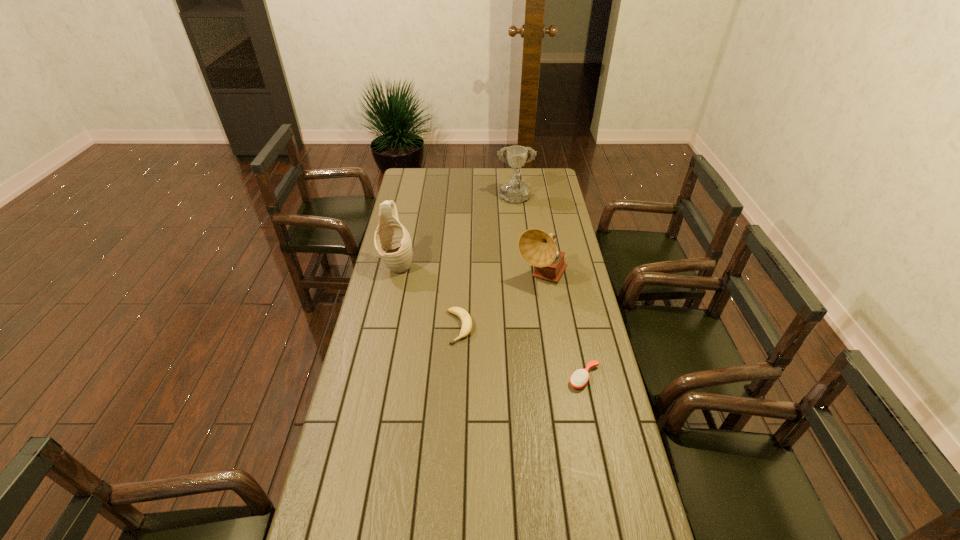
Find the location of a particular element. vacant point located between the nearest object and the leftmost object is located at coordinates (491, 322).

This screenshot has width=960, height=540. I want to click on unoccupied area between the farthest object and the second object from left to right, so click(x=487, y=264).

Locate an element on the screen. This screenshot has width=960, height=540. vacant area that lies between the phonograph record and the leftmost object is located at coordinates (469, 272).

This screenshot has width=960, height=540. I want to click on free spot between the farthest object and the leftmost object, so click(x=456, y=233).

Identify the location of free space that is in between the farthest object and the leftmost object. (456, 233).

At what (x,y) coordinates should I click in order to perform the action: click on the second closest object relative to the pitcher. Please return your answer as a coordinate pair (x, y). This screenshot has width=960, height=540. Looking at the image, I should click on (538, 248).

The width and height of the screenshot is (960, 540). What are the coordinates of `the third closest object to the award` in the screenshot? It's located at (466, 320).

At what (x,y) coordinates should I click in order to perform the action: click on free space that satisfies the following two spatial constraints: 1. on the horn of the phonograph record; 2. on the left side of the hairbrush. Please return your answer as a coordinate pair (x, y). The height and width of the screenshot is (540, 960). Looking at the image, I should click on (558, 377).

The width and height of the screenshot is (960, 540). Identify the location of vacant space that satisfies the following two spatial constraints: 1. on the side with emblem of the farthest object; 2. on the right side of the hairbrush. (534, 377).

At what (x,y) coordinates should I click in order to perform the action: click on vacant space that satisfies the following two spatial constraints: 1. on the horn of the phonograph record; 2. on the right side of the hairbrush. Please return your answer as a coordinate pair (x, y). Looking at the image, I should click on (558, 377).